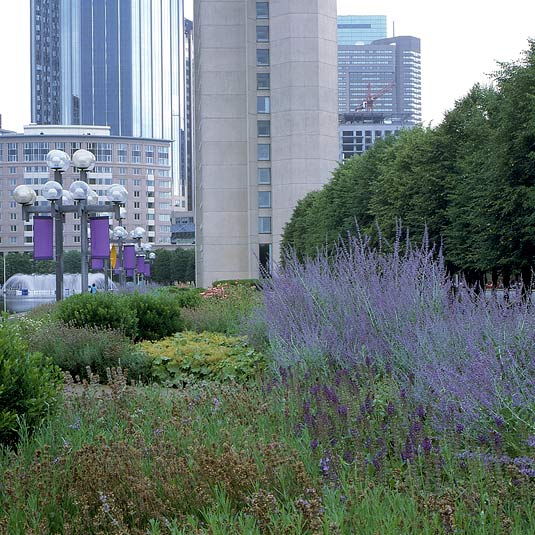
The height and width of the screenshot is (535, 535). In order to click on windows in this screenshot , I will do `click(263, 198)`, `click(262, 178)`.